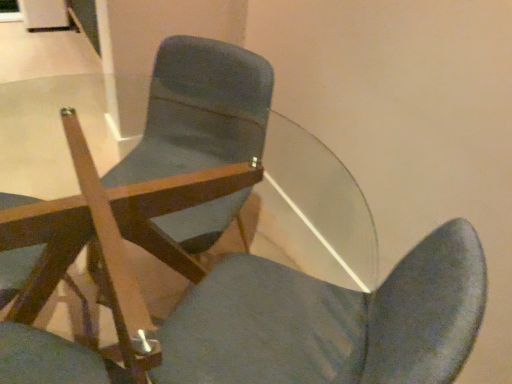
Describe the element at coordinates (16, 271) in the screenshot. I see `wooden chair at center, which is the 1th chair from left to right` at that location.

Image resolution: width=512 pixels, height=384 pixels. What are the coordinates of `wooden chair at center, which is the 1th chair from left to right` in the screenshot? It's located at (16, 271).

Describe the element at coordinates (200, 111) in the screenshot. The height and width of the screenshot is (384, 512). I see `matte wood chair at center, the third chair viewed from the left` at that location.

This screenshot has height=384, width=512. I want to click on matte wood chair at center, which is the 1th chair from right to left, so click(x=200, y=111).

Identify the location of wooden chair at center, which is the 1th chair from left to right. (16, 271).

Which is behind, point (24, 199) or point (111, 196)?

The point (24, 199) is farther.

Where is `chair that is below the matte wood chair at center, arranged as the second chair when viewed from the right (from the image's perspective)`? The height and width of the screenshot is (384, 512). chair that is below the matte wood chair at center, arranged as the second chair when viewed from the right (from the image's perspective) is located at coordinates (16, 271).

Is wooden chair at center, which is the 1th chair from left to right, oriented towards matte wood chair at center, arranged as the second chair when viewed from the right?

Yes, wooden chair at center, which is the 1th chair from left to right, is turned towards matte wood chair at center, arranged as the second chair when viewed from the right.

Could matte wood chair at center, arranged as the second chair when viewed from the right, be considered to be inside wooden chair at center, which is the 1th chair from left to right?

No, matte wood chair at center, arranged as the second chair when viewed from the right, is located outside of wooden chair at center, which is the 1th chair from left to right.

Considering the sizes of objects matte wood chair at center, the third chair viewed from the left, and wooden chair at center, which appears as the third chair when viewed from the right, in the image provided, who is taller, matte wood chair at center, the third chair viewed from the left, or wooden chair at center, which appears as the third chair when viewed from the right,?

With more height is matte wood chair at center, the third chair viewed from the left.

Is matte wood chair at center, the third chair viewed from the left, closer to camera compared to wooden chair at center, which is the 1th chair from left to right?

No, the depth of matte wood chair at center, the third chair viewed from the left, is greater than that of wooden chair at center, which is the 1th chair from left to right.

From the image's perspective, relative to wooden chair at center, which is the 1th chair from left to right, is matte wood chair at center, which is the 1th chair from right to left, above or below?

Clearly, from the image's perspective, matte wood chair at center, which is the 1th chair from right to left, is above wooden chair at center, which is the 1th chair from left to right.

Does matte wood chair at center, which is the 1th chair from right to left, have a smaller size compared to wooden chair at center, which is the 1th chair from left to right?

No.

How different are the orientations of transparent glass door at upper center and matte wood chair at center, the third chair viewed from the left, in degrees?

The angle between the facing direction of transparent glass door at upper center and the facing direction of matte wood chair at center, the third chair viewed from the left, is 49.5 degrees.

Who is taller, transparent glass door at upper center or matte wood chair at center, which is the 1th chair from right to left?

matte wood chair at center, which is the 1th chair from right to left.

From a real-world perspective, is transparent glass door at upper center located beneath matte wood chair at center, which is the 1th chair from right to left?

Yes, from a real-world perspective, transparent glass door at upper center is beneath matte wood chair at center, which is the 1th chair from right to left.

From the image's perspective, is transparent glass door at upper center located above or below matte wood chair at center, which is the 1th chair from right to left?

Clearly, from the image's perspective, transparent glass door at upper center is above matte wood chair at center, which is the 1th chair from right to left.

Which is closer to the camera, (15, 21) or (89, 315)?

The point (89, 315) is closer to the camera.

Can you confirm if transparent glass door at upper center is positioned to the left of wooden chair at center, which is the 1th chair from left to right?

Correct, you'll find transparent glass door at upper center to the left of wooden chair at center, which is the 1th chair from left to right.

Is transparent glass door at upper center oriented towards wooden chair at center, which is the 1th chair from left to right?

Yes, transparent glass door at upper center is facing wooden chair at center, which is the 1th chair from left to right.

Which object is thinner, transparent glass door at upper center or wooden chair at center, which is the 1th chair from left to right?

transparent glass door at upper center.

Is matte wood chair at center, which is the 1th chair from right to left, located within wooden chair at center, which is the 1th chair from left to right?

No, matte wood chair at center, which is the 1th chair from right to left, is not a part of wooden chair at center, which is the 1th chair from left to right.

From the image's perspective, starting from the matte wood chair at center, which is the 1th chair from right to left, which chair is the 2nd one below? Please provide its 2D coordinates.

[(16, 271)]

Could you tell me if wooden chair at center, which is the 1th chair from left to right, is facing matte wood chair at center, which is the 1th chair from right to left?

Yes, wooden chair at center, which is the 1th chair from left to right, faces towards matte wood chair at center, which is the 1th chair from right to left.

From a real-world perspective, is wooden chair at center, which is the 1th chair from left to right, above or below matte wood chair at center, which is the 1th chair from right to left?

wooden chair at center, which is the 1th chair from left to right, is situated higher than matte wood chair at center, which is the 1th chair from right to left, in the real world.

Identify the location of glass door that is above the wooden chair at center, which is the 1th chair from left to right (from the image's perspective). This screenshot has height=384, width=512. [10, 11].

Which is more to the left, wooden chair at center, which is the 1th chair from left to right, or transparent glass door at upper center?

From the viewer's perspective, transparent glass door at upper center appears more on the left side.

Is wooden chair at center, which appears as the third chair when viewed from the right, aimed at transparent glass door at upper center?

No, wooden chair at center, which appears as the third chair when viewed from the right, is not oriented towards transparent glass door at upper center.

Between wooden chair at center, which appears as the third chair when viewed from the right, and transparent glass door at upper center, which one has smaller width?

transparent glass door at upper center is thinner.

Is matte wood chair at center, arranged as the second chair when viewed from the left, far away from matte wood chair at center, which is the 1th chair from right to left?

That's not correct — matte wood chair at center, arranged as the second chair when viewed from the left, is a little close to matte wood chair at center, which is the 1th chair from right to left.

Which is more to the left, matte wood chair at center, arranged as the second chair when viewed from the right, or matte wood chair at center, the third chair viewed from the left?

Positioned to the left is matte wood chair at center, arranged as the second chair when viewed from the right.

Does matte wood chair at center, arranged as the second chair when viewed from the right, have a greater width compared to matte wood chair at center, the third chair viewed from the left?

Yes, matte wood chair at center, arranged as the second chair when viewed from the right, is wider than matte wood chair at center, the third chair viewed from the left.

From a real-world perspective, is matte wood chair at center, arranged as the second chair when viewed from the right, above or below matte wood chair at center, which is the 1th chair from right to left?

Clearly, from a real-world perspective, matte wood chair at center, arranged as the second chair when viewed from the right, is below matte wood chair at center, which is the 1th chair from right to left.

Locate an element on the screen. the 1st chair positioned above the wooden chair at center, which is the 1th chair from left to right (from the image's perspective) is located at coordinates (240, 299).

The width and height of the screenshot is (512, 384). Identify the location of chair behind the wooden chair at center, which appears as the third chair when viewed from the right. (200, 111).

Estimate the real-world distances between objects in this image. Which object is further from matte wood chair at center, arranged as the second chair when viewed from the right, wooden chair at center, which appears as the third chair when viewed from the right, or transparent glass door at upper center?

Based on the image, transparent glass door at upper center appears to be further to matte wood chair at center, arranged as the second chair when viewed from the right.

Based on their spatial positions, is matte wood chair at center, arranged as the second chair when viewed from the right, or wooden chair at center, which appears as the third chair when viewed from the right, closer to transparent glass door at upper center?

The object closer to transparent glass door at upper center is wooden chair at center, which appears as the third chair when viewed from the right.

Considering their positions, is transparent glass door at upper center positioned closer to wooden chair at center, which appears as the third chair when viewed from the right, than matte wood chair at center, arranged as the second chair when viewed from the left?

matte wood chair at center, arranged as the second chair when viewed from the left, is closer to wooden chair at center, which appears as the third chair when viewed from the right.

Considering their positions, is wooden chair at center, which is the 1th chair from left to right, positioned closer to transparent glass door at upper center than matte wood chair at center, arranged as the second chair when viewed from the right?

wooden chair at center, which is the 1th chair from left to right, lies closer to transparent glass door at upper center than the other object.

From the picture: Which object lies nearer to the anchor point matte wood chair at center, arranged as the second chair when viewed from the left, transparent glass door at upper center or matte wood chair at center, which is the 1th chair from right to left?

matte wood chair at center, which is the 1th chair from right to left.

When comparing their distances from matte wood chair at center, the third chair viewed from the left, does matte wood chair at center, arranged as the second chair when viewed from the right, or wooden chair at center, which appears as the third chair when viewed from the right, seem closer?

matte wood chair at center, arranged as the second chair when viewed from the right.

Looking at this image, from the image, which object appears to be farther from matte wood chair at center, arranged as the second chair when viewed from the left, wooden chair at center, which appears as the third chair when viewed from the right, or matte wood chair at center, the third chair viewed from the left?

Among the two, matte wood chair at center, the third chair viewed from the left, is located further to matte wood chair at center, arranged as the second chair when viewed from the left.

From the image, which object appears to be farther from transparent glass door at upper center, wooden chair at center, which is the 1th chair from left to right, or matte wood chair at center, which is the 1th chair from right to left?

wooden chair at center, which is the 1th chair from left to right, lies further to transparent glass door at upper center than the other object.

Locate an element on the screen. chair between wooden chair at center, which appears as the third chair when viewed from the right, and transparent glass door at upper center, along the z-axis is located at coordinates (200, 111).

Where is `chair positioned between matte wood chair at center, arranged as the second chair when viewed from the right, and matte wood chair at center, which is the 1th chair from right to left, from near to far`? chair positioned between matte wood chair at center, arranged as the second chair when viewed from the right, and matte wood chair at center, which is the 1th chair from right to left, from near to far is located at coordinates (16, 271).